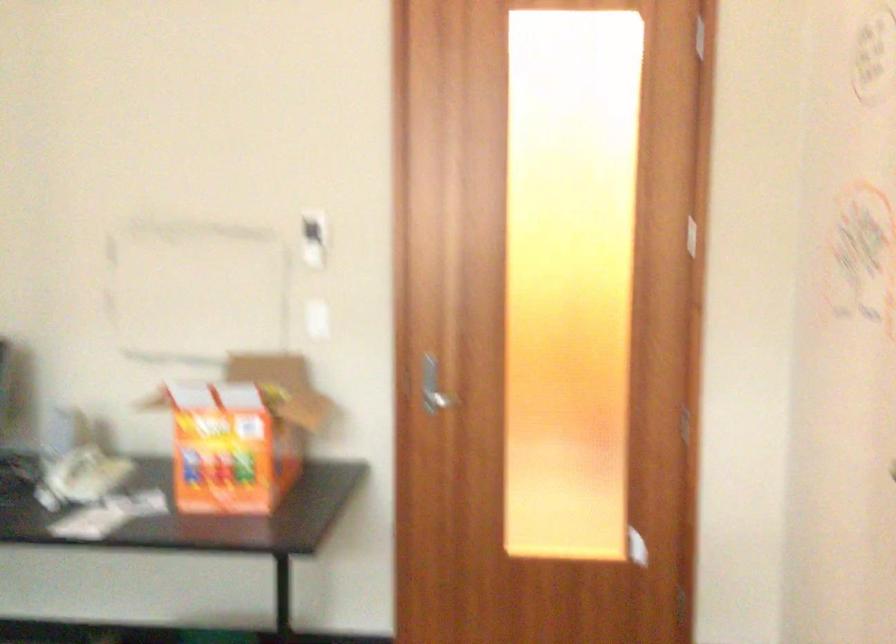
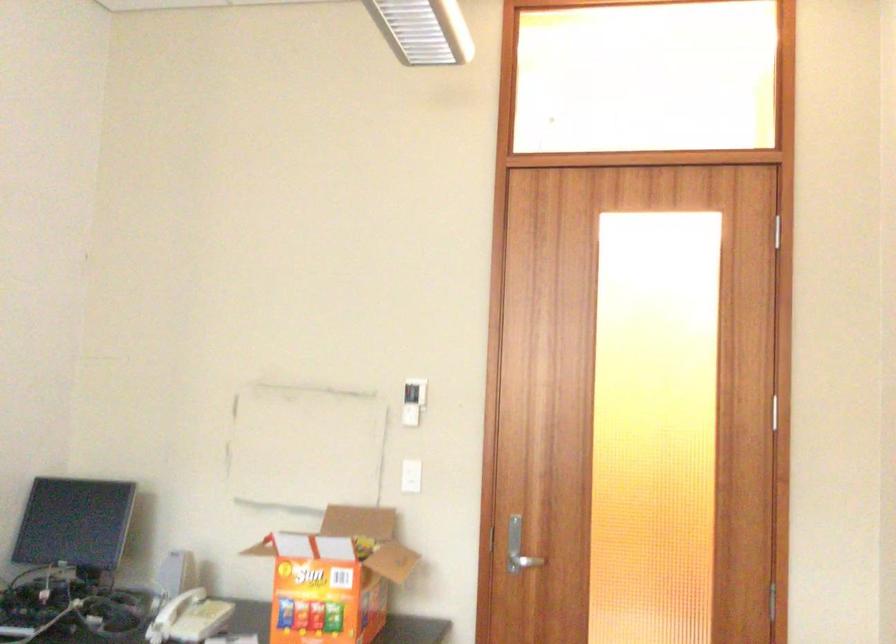
In a continuous first-person perspective shot, in which direction is the camera moving?

The cameraman walked toward right, backward.